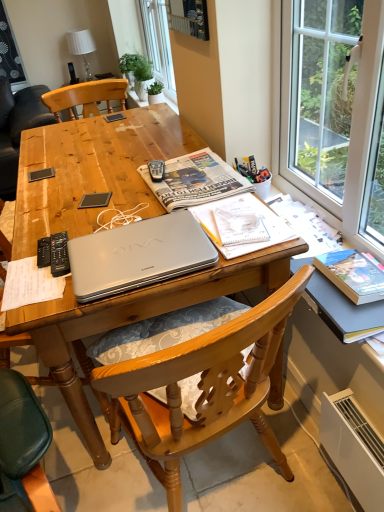
Question: Considering the relative sizes of silver metallic laptop at center and black plastic remote control at left, positioned as the 2th remote control in left-to-right order, in the image provided, is silver metallic laptop at center bigger than black plastic remote control at left, positioned as the 2th remote control in left-to-right order,?

Choices:
 (A) no
 (B) yes

Answer: (B)

Question: Considering the relative positions of silver metallic laptop at center and black plastic remote control at left, positioned as the 2th remote control in left-to-right order, in the image provided, is silver metallic laptop at center to the left of black plastic remote control at left, positioned as the 2th remote control in left-to-right order, from the viewer's perspective?

Choices:
 (A) no
 (B) yes

Answer: (A)

Question: Is silver metallic laptop at center shorter than black plastic remote control at left, which is counted as the first remote control, starting from the right?

Choices:
 (A) yes
 (B) no

Answer: (B)

Question: Can you confirm if silver metallic laptop at center is thinner than black plastic remote control at left, which is counted as the first remote control, starting from the right?

Choices:
 (A) yes
 (B) no

Answer: (B)

Question: Considering the relative sizes of silver metallic laptop at center and black plastic remote control at left, positioned as the 2th remote control in left-to-right order, in the image provided, is silver metallic laptop at center taller than black plastic remote control at left, positioned as the 2th remote control in left-to-right order,?

Choices:
 (A) yes
 (B) no

Answer: (A)

Question: Is white fabric lampshade at upper center inside or outside of silver metallic laptop at center?

Choices:
 (A) outside
 (B) inside

Answer: (A)

Question: Considering the positions of white fabric lampshade at upper center and silver metallic laptop at center in the image, is white fabric lampshade at upper center bigger or smaller than silver metallic laptop at center?

Choices:
 (A) big
 (B) small

Answer: (A)

Question: From the image's perspective, is white fabric lampshade at upper center located above or below silver metallic laptop at center?

Choices:
 (A) below
 (B) above

Answer: (B)

Question: In terms of width, does white fabric lampshade at upper center look wider or thinner when compared to silver metallic laptop at center?

Choices:
 (A) wide
 (B) thin

Answer: (B)

Question: Considering the positions of wooden table at center and black plastic remote control at left, which is counted as the first remote control, starting from the left, in the image, is wooden table at center bigger or smaller than black plastic remote control at left, which is counted as the first remote control, starting from the left,?

Choices:
 (A) big
 (B) small

Answer: (A)

Question: Is wooden table at center wider or thinner than black plastic remote control at left, which is counted as the second remote control, starting from the right?

Choices:
 (A) thin
 (B) wide

Answer: (B)

Question: Which is correct: wooden table at center is inside black plastic remote control at left, which is counted as the first remote control, starting from the left, or outside of it?

Choices:
 (A) outside
 (B) inside

Answer: (A)

Question: From a real-world perspective, is wooden table at center above or below black plastic remote control at left, which is counted as the second remote control, starting from the right?

Choices:
 (A) below
 (B) above

Answer: (A)

Question: In the image, is black plastic remote control at left, positioned as the 2th remote control in left-to-right order, positioned in front of or behind silver metallic laptop at center?

Choices:
 (A) behind
 (B) front

Answer: (B)

Question: Based on their sizes in the image, would you say black plastic remote control at left, positioned as the 2th remote control in left-to-right order, is bigger or smaller than silver metallic laptop at center?

Choices:
 (A) big
 (B) small

Answer: (B)